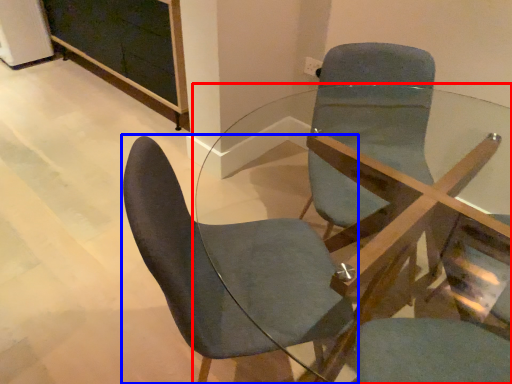
Question: Which point is closer to the camera, table (highlighted by a red box) or chair (highlighted by a blue box)?

Choices:
 (A) table
 (B) chair

Answer: (A)